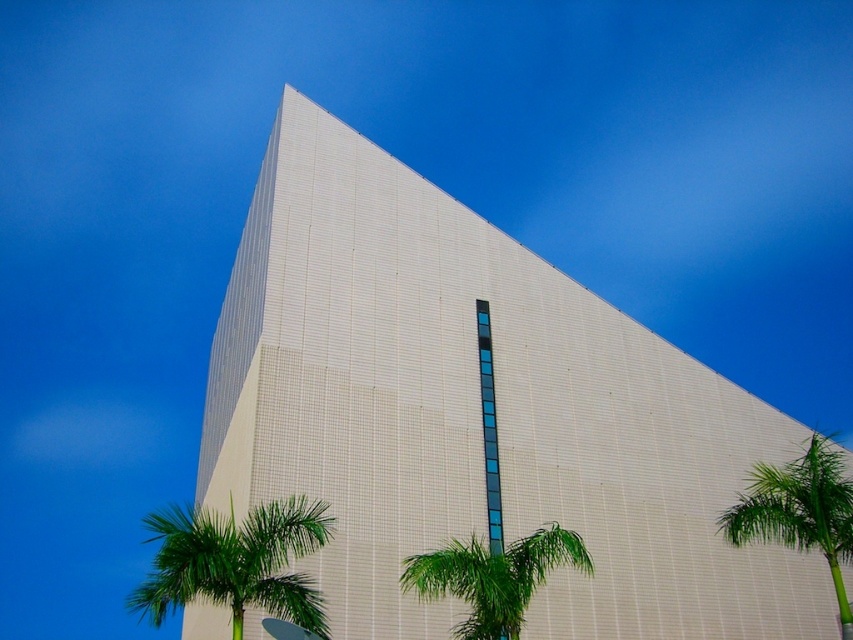
You are standing in front of the building and want to take a photo of both the green leafy palm tree at lower left and the green leafy palm tree at lower center. Which palm tree should you focus on first to ensure both are in frame?

You should focus on the green leafy palm tree at lower left first because it is taller than the green leafy palm tree at lower center, so adjusting the camera angle to include its full height will naturally include the shorter tree as well.

Based on the photo, you are standing in front of the architectural structure and want to take a photo of the green leafy palm tree at lower left. The camera you are using has a maximum focus range of 30 meters. Will you be able to capture the tree in focus?

The green leafy palm tree at lower left is 29.19 meters from viewer. Since the camera can focus up to 30 meters, it is within range, so yes, you can capture the tree in focus.